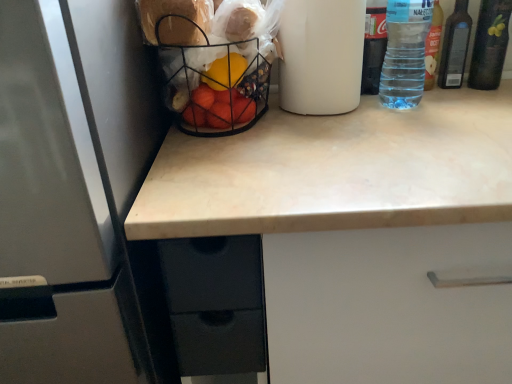
Question: Is the depth of transparent plastic bottle at upper right, the fourth bottle when ordered from right to left, less than that of transparent plastic bottle at upper right, arranged as the 3th bottle when viewed from the right?

Choices:
 (A) no
 (B) yes

Answer: (A)

Question: Is transparent plastic bottle at upper right, which ranks as the 1th bottle in left-to-right order, far away from transparent plastic bottle at upper right, arranged as the 3th bottle when viewed from the right?

Choices:
 (A) yes
 (B) no

Answer: (B)

Question: Are transparent plastic bottle at upper right, the fourth bottle when ordered from right to left, and transparent plastic bottle at upper right, arranged as the 3th bottle when viewed from the right, making contact?

Choices:
 (A) yes
 (B) no

Answer: (B)

Question: Would you say transparent plastic bottle at upper right, arranged as the 3th bottle when viewed from the right, is part of transparent plastic bottle at upper right, which ranks as the 1th bottle in left-to-right order,'s contents?

Choices:
 (A) yes
 (B) no

Answer: (B)

Question: Considering the relative sizes of transparent plastic bottle at upper right, the fourth bottle when ordered from right to left, and transparent plastic bottle at upper right, arranged as the 3th bottle when viewed from the right, in the image provided, is transparent plastic bottle at upper right, the fourth bottle when ordered from right to left, smaller than transparent plastic bottle at upper right, arranged as the 3th bottle when viewed from the right,?

Choices:
 (A) no
 (B) yes

Answer: (B)

Question: Would you say beige marble countertop at center is inside or outside transparent plastic bottle at upper right, arranged as the 2th bottle when viewed from the left?

Choices:
 (A) outside
 (B) inside

Answer: (A)

Question: Is beige marble countertop at center wider or thinner than transparent plastic bottle at upper right, arranged as the 2th bottle when viewed from the left?

Choices:
 (A) thin
 (B) wide

Answer: (B)

Question: Based on their sizes in the image, would you say beige marble countertop at center is bigger or smaller than transparent plastic bottle at upper right, arranged as the 3th bottle when viewed from the right?

Choices:
 (A) big
 (B) small

Answer: (A)

Question: From the image's perspective, is beige marble countertop at center positioned above or below transparent plastic bottle at upper right, arranged as the 2th bottle when viewed from the left?

Choices:
 (A) above
 (B) below

Answer: (B)

Question: From a real-world perspective, is beige marble countertop at center above or below satin white refrigerator at left?

Choices:
 (A) above
 (B) below

Answer: (B)

Question: Looking at their shapes, would you say beige marble countertop at center is wider or thinner than satin white refrigerator at left?

Choices:
 (A) thin
 (B) wide

Answer: (B)

Question: Would you say beige marble countertop at center is to the left or to the right of satin white refrigerator at left in the picture?

Choices:
 (A) right
 (B) left

Answer: (A)

Question: From the image's perspective, is beige marble countertop at center above or below satin white refrigerator at left?

Choices:
 (A) above
 (B) below

Answer: (B)

Question: Is transparent plastic bottle at upper right, arranged as the 3th bottle when viewed from the right, bigger or smaller than transparent plastic bottle at upper right, the fourth bottle when ordered from right to left?

Choices:
 (A) small
 (B) big

Answer: (B)

Question: Choose the correct answer: Is transparent plastic bottle at upper right, arranged as the 2th bottle when viewed from the left, inside transparent plastic bottle at upper right, which ranks as the 1th bottle in left-to-right order, or outside it?

Choices:
 (A) inside
 (B) outside

Answer: (B)